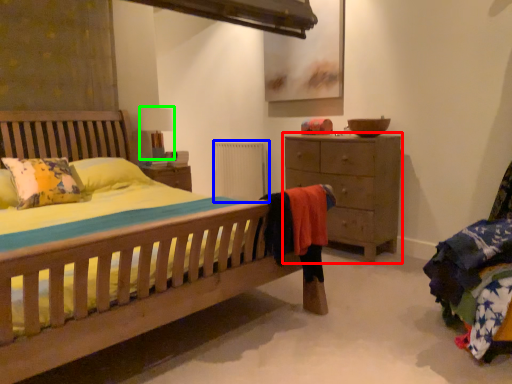
Question: Based on their relative distances, which object is farther from chest of drawers (highlighted by a red box)? Choose from radiator (highlighted by a blue box) and table lamp (highlighted by a green box).

Choices:
 (A) radiator
 (B) table lamp

Answer: (B)